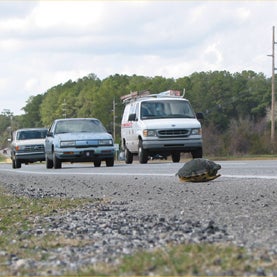
I want to click on window, so click(166, 111).